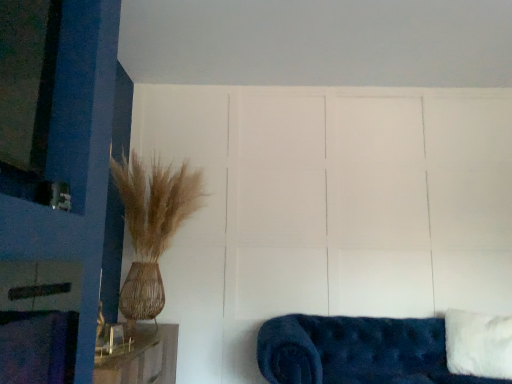
Question: From a real-world perspective, is velvet blue couch at lower right under white fluffy pillow at lower right?

Choices:
 (A) no
 (B) yes

Answer: (B)

Question: Is velvet blue couch at lower right bigger than white fluffy pillow at lower right?

Choices:
 (A) no
 (B) yes

Answer: (B)

Question: Is velvet blue couch at lower right with white fluffy pillow at lower right?

Choices:
 (A) yes
 (B) no

Answer: (B)

Question: From a real-world perspective, is velvet blue couch at lower right physically above white fluffy pillow at lower right?

Choices:
 (A) no
 (B) yes

Answer: (A)

Question: Considering the relative sizes of velvet blue couch at lower right and white fluffy pillow at lower right in the image provided, is velvet blue couch at lower right thinner than white fluffy pillow at lower right?

Choices:
 (A) yes
 (B) no

Answer: (B)

Question: Is velvet blue couch at lower right facing away from white fluffy pillow at lower right?

Choices:
 (A) yes
 (B) no

Answer: (A)

Question: Is white fluffy pillow at lower right positioned with its back to velvet blue couch at lower right?

Choices:
 (A) no
 (B) yes

Answer: (B)

Question: Is white fluffy pillow at lower right far away from velvet blue couch at lower right?

Choices:
 (A) no
 (B) yes

Answer: (A)

Question: Is white fluffy pillow at lower right aimed at velvet blue couch at lower right?

Choices:
 (A) no
 (B) yes

Answer: (B)

Question: Does white fluffy pillow at lower right come in front of velvet blue couch at lower right?

Choices:
 (A) yes
 (B) no

Answer: (B)

Question: Is velvet blue couch at lower right located within white fluffy pillow at lower right?

Choices:
 (A) no
 (B) yes

Answer: (A)

Question: Is white fluffy pillow at lower right taller than velvet blue couch at lower right?

Choices:
 (A) no
 (B) yes

Answer: (B)

Question: Does point (459, 360) appear closer or farther from the camera than point (382, 321)?

Choices:
 (A) closer
 (B) farther

Answer: (A)